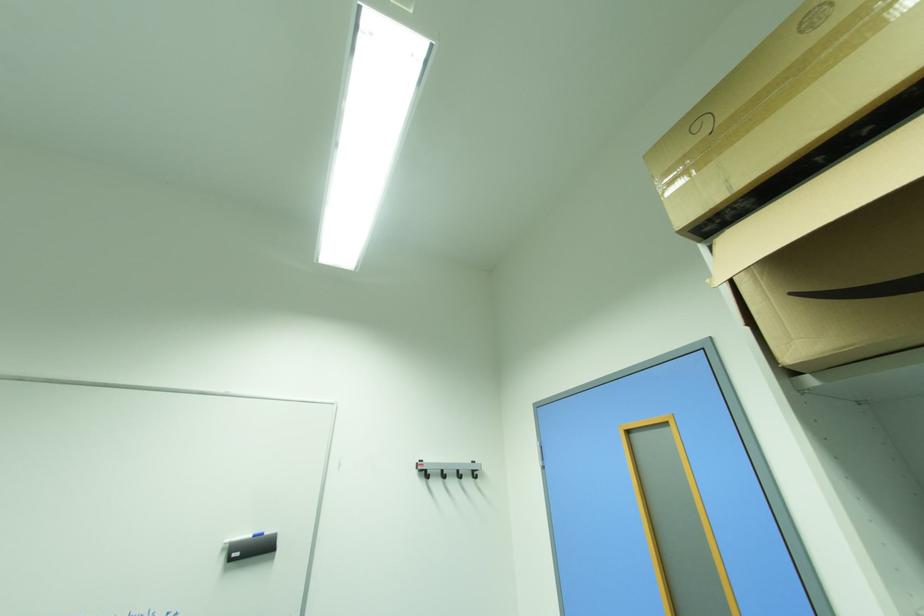
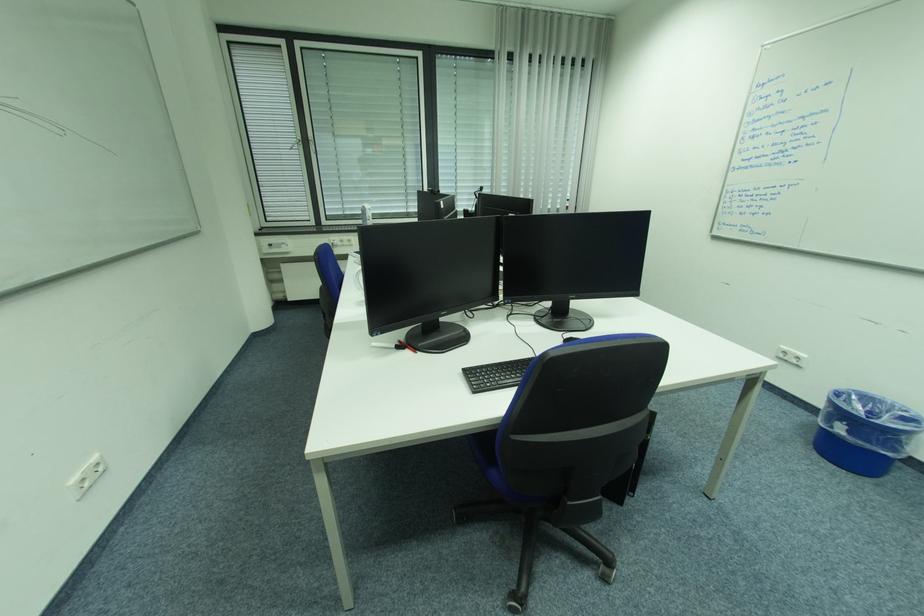
Question: The images are taken continuously from a first-person perspective. In which direction is your viewpoint rotating?

Choices:
 (A) Left
 (B) Right
 (C) Up
 (D) Down

Answer: (A)